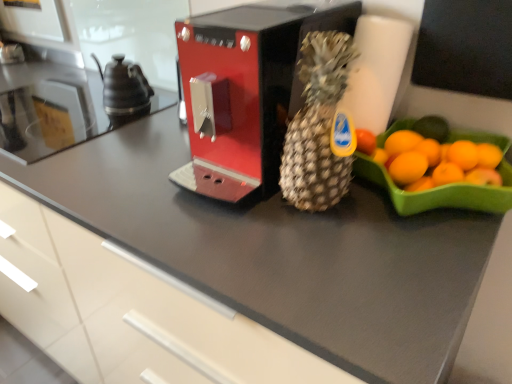
Locate an element on the screen. free space on the front side of brown textured pineapple at center is located at coordinates (336, 253).